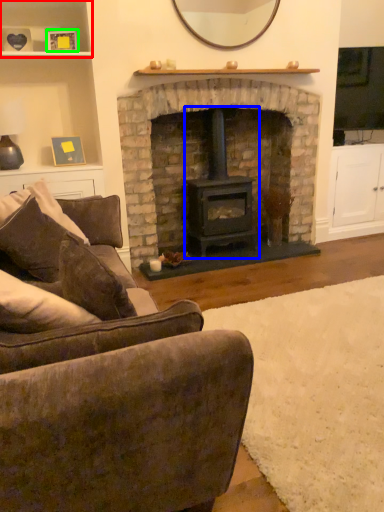
Question: Which object is the farthest from shelf (highlighted by a red box)? Choose among these: wood burning stove (highlighted by a blue box) or picture frame (highlighted by a green box).

Choices:
 (A) wood burning stove
 (B) picture frame

Answer: (A)